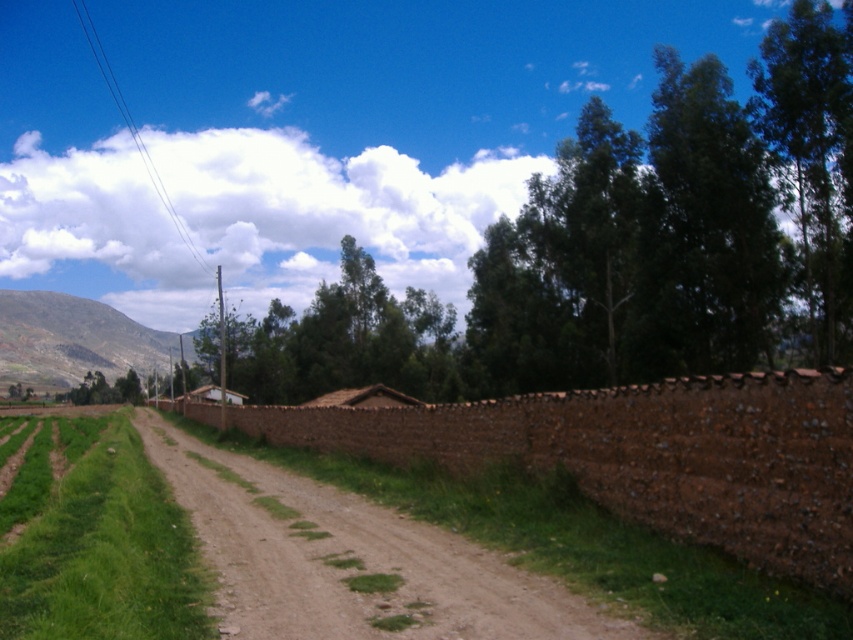
You are standing at point (621, 250) in the rural scene. What do you see directly in front of you?

At point (621, 250) lies green leafy tree at upper center, so you would see the green leafy tree at upper center directly in front of you.